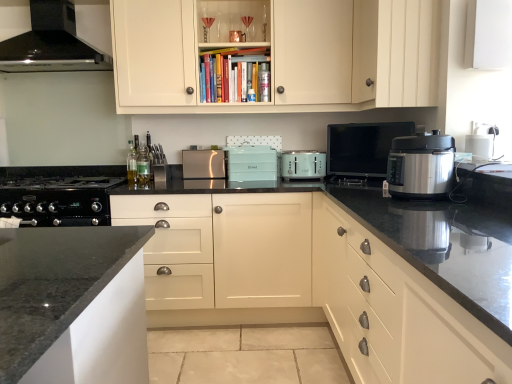
I want to click on black glossy television at upper right, the 2th kitchen appliance viewed from the front, so click(x=362, y=147).

Measure the distance between matte white cabinet at center, which is counted as the 5th cabinetry, starting from the top, and camera.

They are 8.06 feet apart.

This screenshot has width=512, height=384. Identify the location of matte white cabinet at upper center, which is the 1th cabinetry in top-to-bottom order. click(x=284, y=56).

Locate an element on the screen. white matte cabinet at upper right, the 2th cabinetry viewed from the top is located at coordinates (396, 52).

How much space does white matte cabinet at upper right, the fourth cabinetry positioned from the bottom, occupy horizontally?

The width of white matte cabinet at upper right, the fourth cabinetry positioned from the bottom, is 39.38 centimeters.

Locate an element on the screen. white matte cabinet at upper right, which is the 3th cabinetry from top to bottom is located at coordinates (488, 34).

Which kitchen appliance is the 4th one when counting from the left side of the white matte cabinet at upper right, the fourth cabinetry positioned from the bottom? Please provide its 2D coordinates.

[(252, 163)]

From the image's perspective, does mint green plastic bread bin at center, which is the second kitchen appliance from left to right, appear lower than white matte cabinet at upper right, the 2th cabinetry viewed from the top?

Yes, from the image's perspective, mint green plastic bread bin at center, which is the second kitchen appliance from left to right, is below white matte cabinet at upper right, the 2th cabinetry viewed from the top.

Looking at this image, does mint green plastic bread bin at center, acting as the second kitchen appliance starting from the back, touch white matte cabinet at upper right, the fourth cabinetry positioned from the bottom?

No.

Can you tell me how much mint green plastic bread bin at center, acting as the second kitchen appliance starting from the back, and white matte cabinet at upper right, the fourth cabinetry positioned from the bottom, differ in facing direction?

89.3 degrees.

Is translucent glass bottle at center, positioned as the second bottle in left-to-right order, bigger than white matte cabinet at upper right, the fourth cabinetry positioned from the bottom?

Actually, translucent glass bottle at center, positioned as the second bottle in left-to-right order, might be smaller than white matte cabinet at upper right, the fourth cabinetry positioned from the bottom.

From the picture: Can you confirm if translucent glass bottle at center, which appears as the 1th bottle when viewed from the right, is positioned to the right of white matte cabinet at upper right, the fourth cabinetry positioned from the bottom?

No, translucent glass bottle at center, which appears as the 1th bottle when viewed from the right, is not to the right of white matte cabinet at upper right, the fourth cabinetry positioned from the bottom.

Can you tell me how much translucent glass bottle at center, which appears as the 1th bottle when viewed from the right, and white matte cabinet at upper right, the 2th cabinetry viewed from the top, differ in facing direction?

There is a 86.7-degree angle between the facing directions of translucent glass bottle at center, which appears as the 1th bottle when viewed from the right, and white matte cabinet at upper right, the 2th cabinetry viewed from the top.

Would you say black matte oven at left, the 2th home appliance from the top, is a long distance from satin silver pressure cooker at right, the 1th kitchen appliance positioned from the front?

Yes, black matte oven at left, the 2th home appliance from the top, and satin silver pressure cooker at right, the 1th kitchen appliance positioned from the front, are quite far apart.

Can you tell me how much black matte oven at left, which is counted as the first home appliance, starting from the bottom, and satin silver pressure cooker at right, which ranks as the 5th kitchen appliance in back-to-front order, differ in facing direction?

They differ by 87.8 degrees in their facing directions.

Could you tell me if black matte oven at left, the 2th home appliance from the top, is facing satin silver pressure cooker at right, marked as the 1th kitchen appliance in a right-to-left arrangement?

No.

Which object is more forward, black matte oven at left, which is counted as the first home appliance, starting from the bottom, or satin silver pressure cooker at right, marked as the 1th kitchen appliance in a right-to-left arrangement?

Positioned in front is satin silver pressure cooker at right, marked as the 1th kitchen appliance in a right-to-left arrangement.

From a real-world perspective, is satin silver pressure cooker at right, which is the fifth kitchen appliance from left to right, physically located above or below mint green plastic bread bin at center, which is the second kitchen appliance from left to right?

From a real-world perspective, satin silver pressure cooker at right, which is the fifth kitchen appliance from left to right, is physically above mint green plastic bread bin at center, which is the second kitchen appliance from left to right.

Between point (450, 186) and point (230, 179), which one is positioned in front?

The point (450, 186) is closer to the camera.

From the image's perspective, which is above, satin silver pressure cooker at right, which ranks as the 5th kitchen appliance in back-to-front order, or mint green plastic bread bin at center, acting as the second kitchen appliance starting from the back?

From the image's view, mint green plastic bread bin at center, acting as the second kitchen appliance starting from the back, is above.

From the picture: Does satin silver pressure cooker at right, which ranks as the 5th kitchen appliance in back-to-front order, have a larger size compared to mint green plastic bread bin at center, positioned as the 4th kitchen appliance in front-to-back order?

Yes, satin silver pressure cooker at right, which ranks as the 5th kitchen appliance in back-to-front order, is bigger than mint green plastic bread bin at center, positioned as the 4th kitchen appliance in front-to-back order.

From the image's perspective, which kitchen appliance is the 2nd one above the white plastic toaster at center, the 3th kitchen appliance in the back-to-front sequence? Please provide its 2D coordinates.

[(203, 164)]

Is satin silver toaster at center, which ranks as the fifth kitchen appliance in right-to-left order, wider than white plastic toaster at center, which is counted as the third kitchen appliance, starting from the right?

In fact, satin silver toaster at center, which ranks as the fifth kitchen appliance in right-to-left order, might be narrower than white plastic toaster at center, which is counted as the third kitchen appliance, starting from the right.

Which is in front, point (196, 159) or point (322, 154)?

The point (322, 154) is in front.

In the scene shown: Is black glossy television at upper right, positioned as the fourth kitchen appliance in left-to-right order, in contact with translucent glass bottle at center, positioned as the second bottle in left-to-right order?

black glossy television at upper right, positioned as the fourth kitchen appliance in left-to-right order, and translucent glass bottle at center, positioned as the second bottle in left-to-right order, are clearly separated.

The height and width of the screenshot is (384, 512). I want to click on the 4th kitchen appliance to the right of the translucent glass bottle at center, positioned as the second bottle in left-to-right order, starting your count from the anchor, so click(x=362, y=147).

Can you confirm if black glossy television at upper right, positioned as the fourth kitchen appliance in left-to-right order, is bigger than translucent glass bottle at center, positioned as the second bottle in left-to-right order?

Yes, black glossy television at upper right, positioned as the fourth kitchen appliance in left-to-right order, is bigger than translucent glass bottle at center, positioned as the second bottle in left-to-right order.

Is black glossy television at upper right, positioned as the fourth kitchen appliance in left-to-right order, thinner than translucent glass bottle at center, positioned as the second bottle in left-to-right order?

Incorrect, the width of black glossy television at upper right, positioned as the fourth kitchen appliance in left-to-right order, is not less than that of translucent glass bottle at center, positioned as the second bottle in left-to-right order.

How distant is satin silver toaster at center, marked as the first kitchen appliance in a back-to-front arrangement, from matte white cabinet at center, marked as the first cabinetry in a bottom-to-top arrangement?

25.50 inches.

Does satin silver toaster at center, marked as the first kitchen appliance in a back-to-front arrangement, turn towards matte white cabinet at center, marked as the first cabinetry in a bottom-to-top arrangement?

No.

Between satin silver toaster at center, marked as the first kitchen appliance in a back-to-front arrangement, and matte white cabinet at center, which is counted as the 5th cabinetry, starting from the top, which one has larger size?

matte white cabinet at center, which is counted as the 5th cabinetry, starting from the top.

Is satin silver toaster at center, marked as the first kitchen appliance in a back-to-front arrangement, positioned in front of matte white cabinet at center, marked as the first cabinetry in a bottom-to-top arrangement?

No, satin silver toaster at center, marked as the first kitchen appliance in a back-to-front arrangement, is further to the viewer.

There is a white matte cabinet at upper right, the fourth cabinetry positioned from the bottom. At what (x,y) coordinates should I click in order to perform the action: click on the 3rd kitchen appliance below it (from the image's perspective). Please return your answer as a coordinate pair (x, y). Looking at the image, I should click on (252, 163).

Find the location of `the 4th cabinetry counting from the right of the translucent glass bottle at center, which appears as the 1th bottle when viewed from the right`. the 4th cabinetry counting from the right of the translucent glass bottle at center, which appears as the 1th bottle when viewed from the right is located at coordinates (396, 52).

When comparing their distances from translucent glass bottle at center, which appears as the 1th bottle when viewed from the right, does mint green plastic bread bin at center, which is the second kitchen appliance from left to right, or satin silver pressure cooker at right, which is the fifth kitchen appliance from left to right, seem closer?

mint green plastic bread bin at center, which is the second kitchen appliance from left to right.

Which object lies further to the anchor point black glossy range hood at upper left, positioned as the first home appliance in top-to-bottom order, satin silver toaster at center, marked as the first kitchen appliance in a back-to-front arrangement, or white plastic toaster at center, the third kitchen appliance from the front?

white plastic toaster at center, the third kitchen appliance from the front, lies further to black glossy range hood at upper left, positioned as the first home appliance in top-to-bottom order, than the other object.

Estimate the real-world distances between objects in this image. Which object is further from white matte cabinet at upper right, the fourth cabinetry positioned from the bottom, white matte cabinet at upper right, which is the 3th cabinetry from top to bottom, or satin silver toaster at center, positioned as the 5th kitchen appliance in front-to-back order?

satin silver toaster at center, positioned as the 5th kitchen appliance in front-to-back order, lies further to white matte cabinet at upper right, the fourth cabinetry positioned from the bottom, than the other object.

Based on their spatial positions, is matte white cabinet at upper center, marked as the 5th cabinetry in a bottom-to-top arrangement, or satin silver toaster at center, the 1th kitchen appliance in the left-to-right sequence, further from matte white drawers at right, the second cabinetry in the bottom-to-top sequence?

Based on the image, satin silver toaster at center, the 1th kitchen appliance in the left-to-right sequence, appears to be further to matte white drawers at right, the second cabinetry in the bottom-to-top sequence.

Based on their spatial positions, is satin silver pressure cooker at right, which is the fifth kitchen appliance from left to right, or black matte oven at left, which is counted as the first home appliance, starting from the bottom, closer to mint green plastic bread bin at center, positioned as the 4th kitchen appliance in front-to-back order?

black matte oven at left, which is counted as the first home appliance, starting from the bottom, lies closer to mint green plastic bread bin at center, positioned as the 4th kitchen appliance in front-to-back order, than the other object.

Estimate the real-world distances between objects in this image. Which object is closer to white plastic toaster at center, the third kitchen appliance from the front, mint green plastic bread bin at center, which is the second kitchen appliance from left to right, or black matte oven at left, which is counted as the first home appliance, starting from the bottom?

mint green plastic bread bin at center, which is the second kitchen appliance from left to right, is positioned closer to the anchor white plastic toaster at center, the third kitchen appliance from the front.

Estimate the real-world distances between objects in this image. Which object is further from black glossy television at upper right, positioned as the fourth kitchen appliance in left-to-right order, white matte cabinet at upper right, arranged as the 3th cabinetry when ordered from the bottom, or matte white cabinet at center, marked as the first cabinetry in a bottom-to-top arrangement?

The object further to black glossy television at upper right, positioned as the fourth kitchen appliance in left-to-right order, is white matte cabinet at upper right, arranged as the 3th cabinetry when ordered from the bottom.

In the scene shown: Estimate the real-world distances between objects in this image. Which object is further from white matte cabinet at upper right, which is the 3th cabinetry from top to bottom, translucent glass bottle at center, which appears as the 1th bottle when viewed from the right, or white plastic toaster at center, which is counted as the 3th kitchen appliance, starting from the left?

translucent glass bottle at center, which appears as the 1th bottle when viewed from the right, lies further to white matte cabinet at upper right, which is the 3th cabinetry from top to bottom, than the other object.

Identify the location of kitchen appliance located between matte white cabinet at center, marked as the first cabinetry in a bottom-to-top arrangement, and white matte cabinet at upper right, arranged as the 3th cabinetry when ordered from the bottom, in the depth direction. Image resolution: width=512 pixels, height=384 pixels. (421, 166).

Locate an element on the screen. Image resolution: width=512 pixels, height=384 pixels. kitchen appliance located between black matte oven at left, the 2th home appliance from the top, and mint green plastic bread bin at center, which is the second kitchen appliance from left to right, in the left-right direction is located at coordinates (203, 164).

The image size is (512, 384). In order to click on kitchen appliance between matte white drawers at right, positioned as the 4th cabinetry in top-to-bottom order, and white matte cabinet at upper right, which is the 3th cabinetry from top to bottom, in the front-back direction in this screenshot , I will do `click(421, 166)`.

Where is `kitchen appliance between black matte oven at left, the 2th home appliance from the top, and matte white cabinet at upper center, marked as the 5th cabinetry in a bottom-to-top arrangement, in the horizontal direction`? The image size is (512, 384). kitchen appliance between black matte oven at left, the 2th home appliance from the top, and matte white cabinet at upper center, marked as the 5th cabinetry in a bottom-to-top arrangement, in the horizontal direction is located at coordinates (203, 164).